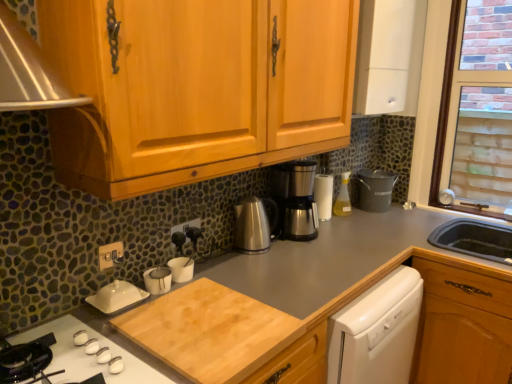
Where is `unoccupied area in front of satin silver coffee machine at center`? This screenshot has width=512, height=384. unoccupied area in front of satin silver coffee machine at center is located at coordinates (298, 253).